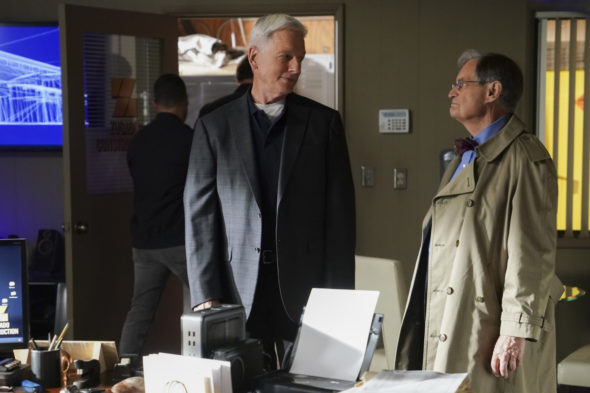
In order to click on tv screen in this screenshot , I will do `click(55, 133)`.